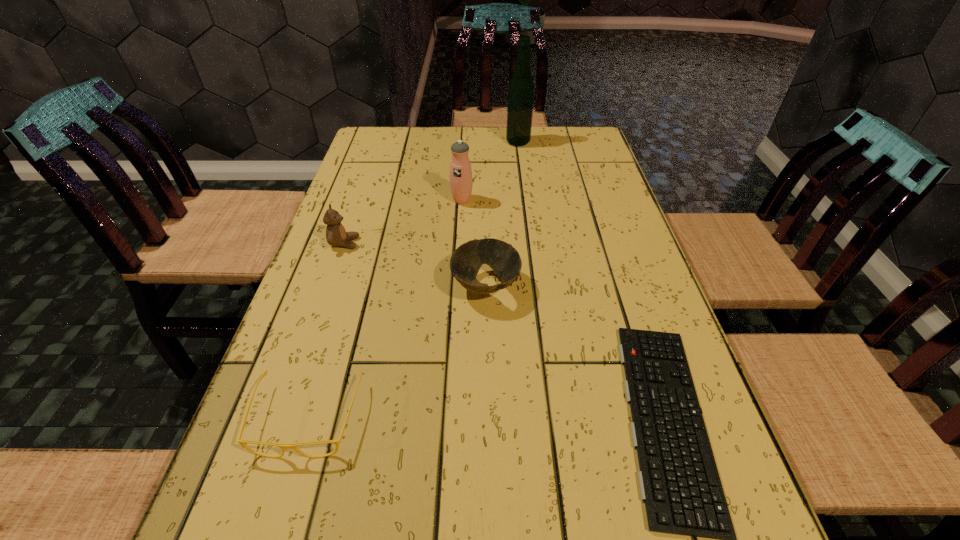
At what (x,y) coordinates should I click in order to perform the action: click on vacant space at the far left corner of the desktop. Please return your answer as a coordinate pair (x, y). This screenshot has height=540, width=960. Looking at the image, I should click on (399, 137).

This screenshot has width=960, height=540. Find the location of `free space that is in between the teddy bear and the spectacles`. free space that is in between the teddy bear and the spectacles is located at coordinates (326, 330).

At what (x,y) coordinates should I click in order to perform the action: click on free space between the bowl and the alcohol. Please return your answer as a coordinate pair (x, y). Looking at the image, I should click on pyautogui.click(x=502, y=214).

Locate an element on the screen. The image size is (960, 540). free space between the thermos bottle and the fifth tallest object is located at coordinates (385, 309).

Identify the location of free space that is in between the fifth tallest object and the farthest object. (413, 280).

Find the location of a particular element. free space between the third shortest object and the alcohol is located at coordinates (502, 214).

This screenshot has width=960, height=540. I want to click on free space that is in between the farthest object and the second shortest object, so (413, 280).

Find the location of a particular element. vacant area that lies between the second shortest object and the tallest object is located at coordinates (413, 280).

At what (x,y) coordinates should I click in order to perform the action: click on vacant area that lies between the second tallest object and the spectacles. Please return your answer as a coordinate pair (x, y). This screenshot has height=540, width=960. Looking at the image, I should click on click(385, 309).

Select which object appears as the closest to the alcohol. Please provide its 2D coordinates. Your answer should be formatted as a tuple, i.e. [(x, y)], where the tuple contains the x and y coordinates of a point satisfying the conditions above.

[(461, 180)]